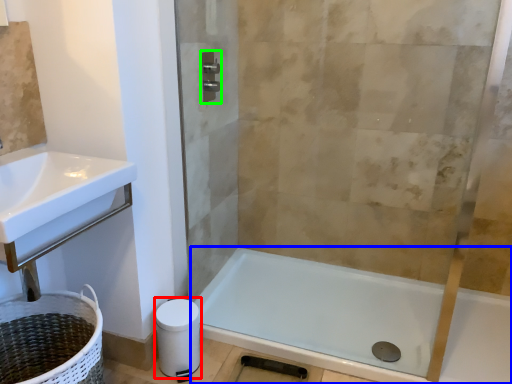
Question: Which object is positioned closest to toilet paper (highlighted by a red box)? Select from bathtub (highlighted by a blue box) and towel bar (highlighted by a green box).

Choices:
 (A) bathtub
 (B) towel bar

Answer: (A)